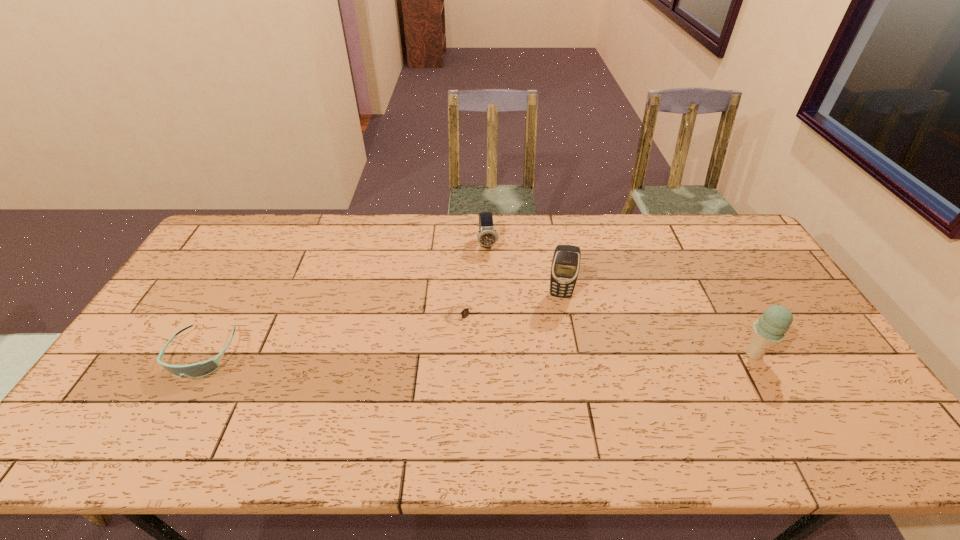
This screenshot has width=960, height=540. I want to click on object present at the left edge, so click(200, 369).

Find the location of `object situated at the right edge`. object situated at the right edge is located at coordinates (770, 329).

The height and width of the screenshot is (540, 960). Find the location of `free space at the far edge of the desktop`. free space at the far edge of the desktop is located at coordinates (540, 219).

Locate an element on the screen. The width and height of the screenshot is (960, 540). vacant space at the near edge of the desktop is located at coordinates (291, 389).

Find the location of a particular element. This screenshot has width=960, height=540. vacant space at the left edge is located at coordinates (207, 263).

Where is `free space at the far left corner`? This screenshot has height=540, width=960. free space at the far left corner is located at coordinates (219, 248).

The width and height of the screenshot is (960, 540). In order to click on free space at the far right corner of the desktop in this screenshot , I will do `click(733, 221)`.

Identify the location of free space between the cellular telephone and the ice cream. The height and width of the screenshot is (540, 960). (657, 325).

This screenshot has width=960, height=540. In order to click on empty space that is in between the leftmost object and the rightmost object in this screenshot , I will do `click(478, 354)`.

You are a GUI agent. You are given a task and a screenshot of the screen. Output one action in this format:
    pyautogui.click(x=<x>, y=<y>)
    Task: Click on the free spot between the ice cream and the second shortest object
    
    Given the screenshot: What is the action you would take?
    pyautogui.click(x=478, y=354)